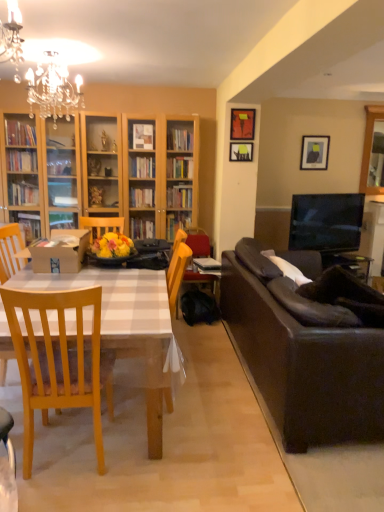
Where is `hardcover book at center`? hardcover book at center is located at coordinates (207, 266).

What do you see at coordinates (53, 89) in the screenshot? The image size is (384, 512). I see `crystal chandelier at upper left` at bounding box center [53, 89].

Find the location of a particular element. This screenshot has height=512, width=384. crystal chandelier at upper left is located at coordinates (53, 89).

The height and width of the screenshot is (512, 384). Find the location of `light wood chair at left`. light wood chair at left is located at coordinates (x=10, y=251).

What is the approximate height of wooden armchair at center?

It is 86.26 centimeters.

Locate an element on the screen. The height and width of the screenshot is (512, 384). matte orange picture frame at upper right, arranged as the third picture frame when viewed from the back is located at coordinates (242, 124).

Does wooden picture frame at upper center, the second picture frame viewed from the back, turn towards matte orange picture frame at upper right, placed as the first picture frame when sorted from front to back?

No, wooden picture frame at upper center, the second picture frame viewed from the back, is not oriented towards matte orange picture frame at upper right, placed as the first picture frame when sorted from front to back.

Which is correct: wooden picture frame at upper center, acting as the 3th picture frame starting from the right, is inside matte orange picture frame at upper right, arranged as the third picture frame when viewed from the back, or outside of it?

wooden picture frame at upper center, acting as the 3th picture frame starting from the right, exists outside the volume of matte orange picture frame at upper right, arranged as the third picture frame when viewed from the back.

In order to click on the 1st picture frame behind the matte orange picture frame at upper right, placed as the first picture frame when sorted from front to back in this screenshot , I will do `click(241, 151)`.

From a real-world perspective, is wooden picture frame at upper center, the second picture frame viewed from the back, under matte orange picture frame at upper right, marked as the 2th picture frame in a left-to-right arrangement?

Yes.

Considering the positions of points (213, 271) and (207, 285), is point (213, 271) closer to camera compared to point (207, 285)?

That is True.

Which object is positioned more to the right, hardcover book at center or wooden armchair at center?

From the viewer's perspective, hardcover book at center appears more on the right side.

This screenshot has width=384, height=512. What are the coordinates of `armchair located below the hardcover book at center (from the image's perspective)` in the screenshot? It's located at (197, 256).

From the picture: From the image's perspective, is hardcover book at center below wooden armchair at center?

No.

Consider the image. From a real-world perspective, between light wood chair at left and crystal chandelier at upper left, who is vertically lower?

light wood chair at left is physically lower.

Does point (7, 256) lie behind point (54, 89)?

No, it is not.

From a real-world perspective, is hardcover book at center physically located above or below wooden picture frame at upper center, which appears as the second picture frame when viewed from the front?

hardcover book at center is below wooden picture frame at upper center, which appears as the second picture frame when viewed from the front.

Visually, is hardcover book at center positioned to the left or to the right of wooden picture frame at upper center, the second picture frame viewed from the back?

Clearly, hardcover book at center is on the left of wooden picture frame at upper center, the second picture frame viewed from the back, in the image.

Which point is more forward, (207, 266) or (242, 151)?

Positioned in front is point (207, 266).

How different are the orientations of wooden table at left and wooden armchair at center in degrees?

The facing directions of wooden table at left and wooden armchair at center are 89.8 degrees apart.

Is wooden table at left oriented towards wooden armchair at center?

No, wooden table at left is not oriented towards wooden armchair at center.

Which object is thinner, wooden table at left or wooden armchair at center?

With smaller width is wooden armchair at center.

Is point (149, 371) closer to viewer compared to point (189, 237)?

Yes.

Does dark brown leather couch at right turn towards wooden picture frame at upper center, the 1th picture frame from the left?

No.

Is dark brown leather couch at right in contact with wooden picture frame at upper center, the 1th picture frame from the left?

No.

From the image's perspective, is dark brown leather couch at right above wooden picture frame at upper center, the 1th picture frame from the left?

No.

Which is nearer, (x=265, y=265) or (x=233, y=147)?

Point (x=265, y=265) is closer to the camera than point (x=233, y=147).

Does hardcover book at center have a lesser width compared to light wood chair at left?

Correct, the width of hardcover book at center is less than that of light wood chair at left.

Is hardcover book at center oriented away from light wood chair at left?

No, hardcover book at center's orientation is not away from light wood chair at left.

Between hardcover book at center and light wood chair at left, which one appears on the left side from the viewer's perspective?

light wood chair at left.

At what (x,y) coordinates should I click in order to perform the action: click on chair that appears below the hardcover book at center (from the image's perspective). Please return your answer as a coordinate pair (x, y). Image resolution: width=384 pixels, height=512 pixels. Looking at the image, I should click on (10, 251).

This screenshot has width=384, height=512. I want to click on the 1st picture frame behind the matte orange picture frame at upper right, arranged as the third picture frame when viewed from the back, so click(241, 151).

Where is `book on the right of wooden armchair at center`? This screenshot has width=384, height=512. book on the right of wooden armchair at center is located at coordinates (207, 266).

Which object lies nearer to the anchor point wooden table at left, wooden picture frame at upper center, the 1th picture frame from the left, or light wood chair at left?

light wood chair at left lies closer to wooden table at left than the other object.

Which object lies nearer to the anchor point light wood chair at left, wooden table at left or hardcover book at center?

The object closer to light wood chair at left is wooden table at left.

Estimate the real-world distances between objects in this image. Which object is further from crystal chandelier at upper left, hardcover book at center or matte black picture frame at upper right, acting as the third picture frame starting from the left?

matte black picture frame at upper right, acting as the third picture frame starting from the left, lies further to crystal chandelier at upper left than the other object.

When comparing their distances from wooden table at left, does dark brown leather couch at right or matte orange picture frame at upper right, acting as the second picture frame starting from the right, seem closer?

The object closer to wooden table at left is dark brown leather couch at right.

Considering their positions, is matte orange picture frame at upper right, acting as the second picture frame starting from the right, positioned further to hardcover book at center than light wood chair at left?

light wood chair at left lies further to hardcover book at center than the other object.

Which object lies further to the anchor point matte orange picture frame at upper right, arranged as the third picture frame when viewed from the back, wooden table at left or matte black picture frame at upper right, acting as the 1th picture frame starting from the right?

The object further to matte orange picture frame at upper right, arranged as the third picture frame when viewed from the back, is wooden table at left.

Based on their spatial positions, is dark brown leather couch at right or light wood chair at left closer to wooden table at left?

Based on the image, dark brown leather couch at right appears to be nearer to wooden table at left.

Considering their positions, is wooden armchair at center positioned closer to matte orange picture frame at upper right, marked as the 2th picture frame in a left-to-right arrangement, than hardcover book at center?

Based on the image, wooden armchair at center appears to be nearer to matte orange picture frame at upper right, marked as the 2th picture frame in a left-to-right arrangement.

I want to click on studio couch located between light wood chair at left and hardcover book at center in the depth direction, so click(304, 354).

You are a GUI agent. You are given a task and a screenshot of the screen. Output one action in this format:
    pyautogui.click(x=<x>, y=<y>)
    Task: Click on the studio couch between wooden table at left and matte orange picture frame at upper right, arranged as the third picture frame when viewed from the back, from front to back
    The width and height of the screenshot is (384, 512).
    Given the screenshot: What is the action you would take?
    pyautogui.click(x=304, y=354)

Where is `armchair between dark brown leather couch at right and hardcover book at center along the z-axis`? armchair between dark brown leather couch at right and hardcover book at center along the z-axis is located at coordinates (197, 256).

Identify the location of armchair between crystal chandelier at upper left and matte black picture frame at upper right, which is the 1th picture frame from back to front, from left to right. (197, 256).